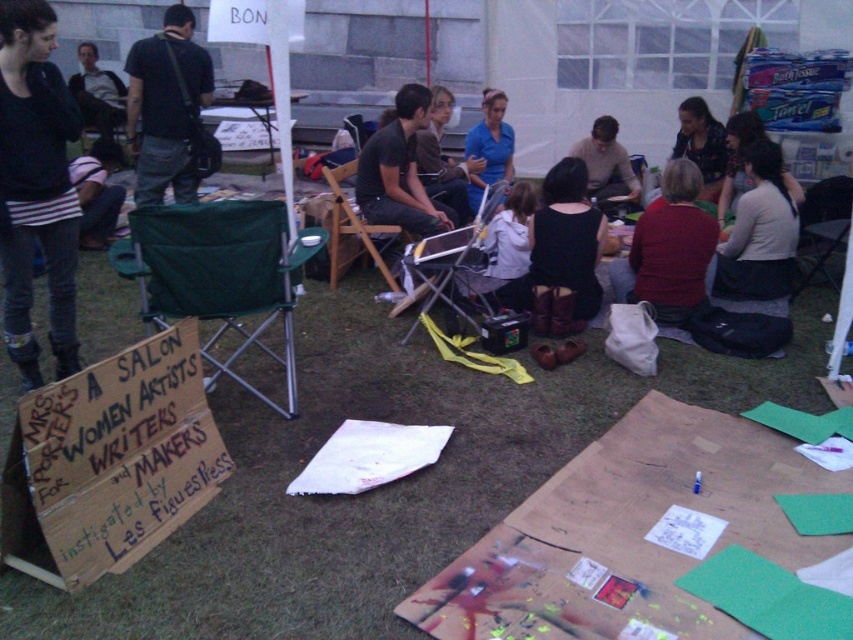
You are organizing a small event and need to arrange seating. You have a green fabric folding chair at lower left and a pink striped shirt at lower left. Which object is more to the left?

The pink striped shirt at lower left is more to the left because the green fabric folding chair at lower left is positioned on its right side.

Looking at this image, you are standing at the center of the grassy area and see the point at coordinates (219, 275). Which object is this point located on?

The point at coordinates (219, 275) is located on the green fabric folding chair at lower left.